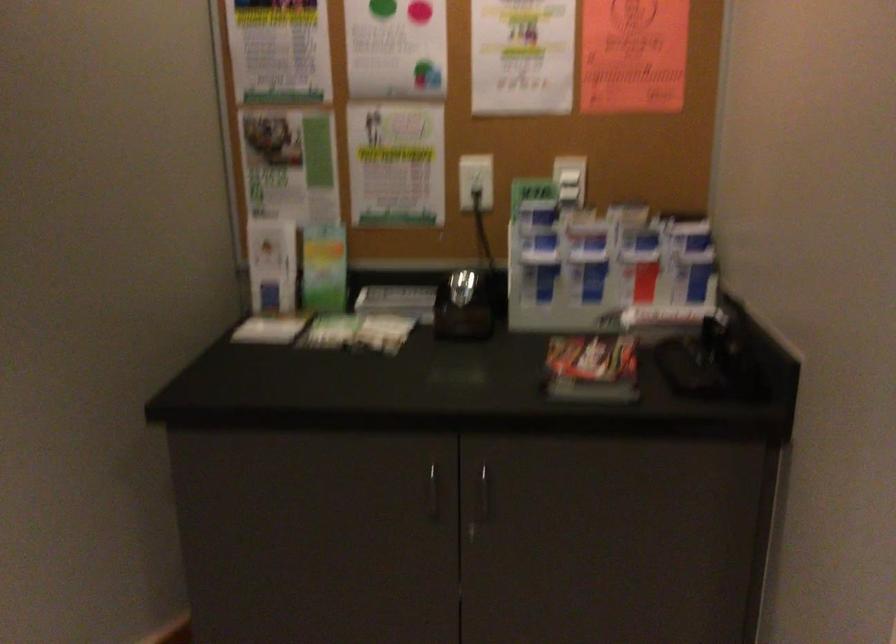
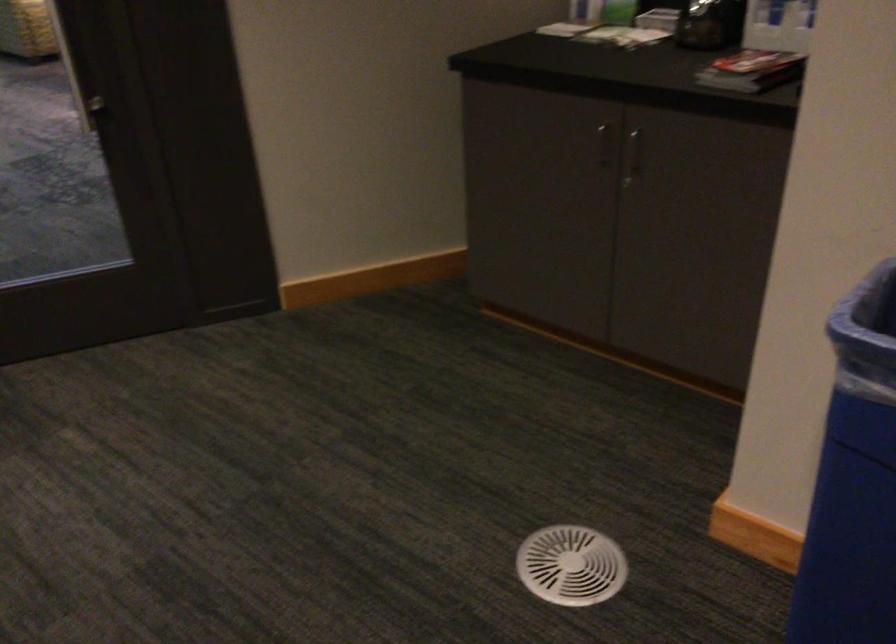
Find the pixel in the second image that matches [478,502] in the first image.

(633, 155)